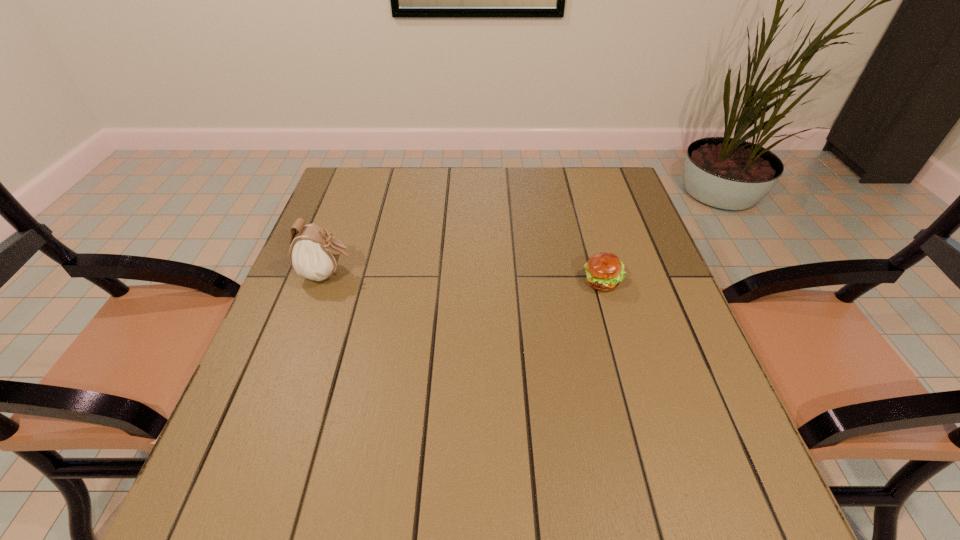
Find the location of a particular element. free location that satisfies the following two spatial constraints: 1. on the front-facing side of the taller object; 2. on the right side of the shorter object is located at coordinates (324, 282).

I want to click on free space that satisfies the following two spatial constraints: 1. on the front-facing side of the pouch; 2. on the left side of the shorter object, so click(324, 282).

This screenshot has width=960, height=540. I want to click on vacant area that satisfies the following two spatial constraints: 1. on the front-facing side of the left object; 2. on the back side of the hamburger, so click(x=324, y=282).

This screenshot has width=960, height=540. Find the location of `vacant position in the image that satisfies the following two spatial constraints: 1. on the back side of the right object; 2. on the front-facing side of the pouch`. vacant position in the image that satisfies the following two spatial constraints: 1. on the back side of the right object; 2. on the front-facing side of the pouch is located at coordinates (600, 274).

Find the location of a particular element. free point that satisfies the following two spatial constraints: 1. on the back side of the shorter object; 2. on the front-facing side of the pouch is located at coordinates (600, 274).

Identify the location of free location that satisfies the following two spatial constraints: 1. on the front-facing side of the shorter object; 2. on the right side of the pouch. Image resolution: width=960 pixels, height=540 pixels. (324, 282).

Locate an element on the screen. The width and height of the screenshot is (960, 540). vacant point that satisfies the following two spatial constraints: 1. on the front-facing side of the right object; 2. on the left side of the pouch is located at coordinates (324, 282).

Locate an element on the screen. The height and width of the screenshot is (540, 960). free spot that satisfies the following two spatial constraints: 1. on the front-facing side of the shorter object; 2. on the left side of the pouch is located at coordinates (324, 282).